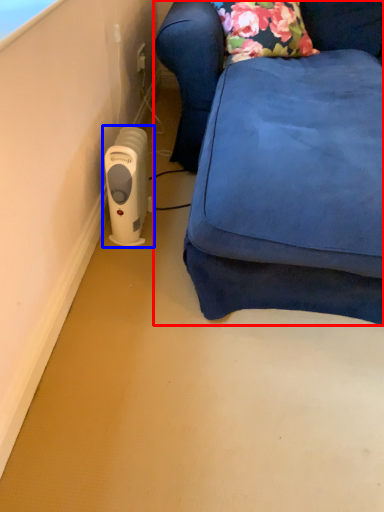
Question: Which object is closer to the camera taking this photo, furniture (highlighted by a red box) or home appliance (highlighted by a blue box)?

Choices:
 (A) furniture
 (B) home appliance

Answer: (A)